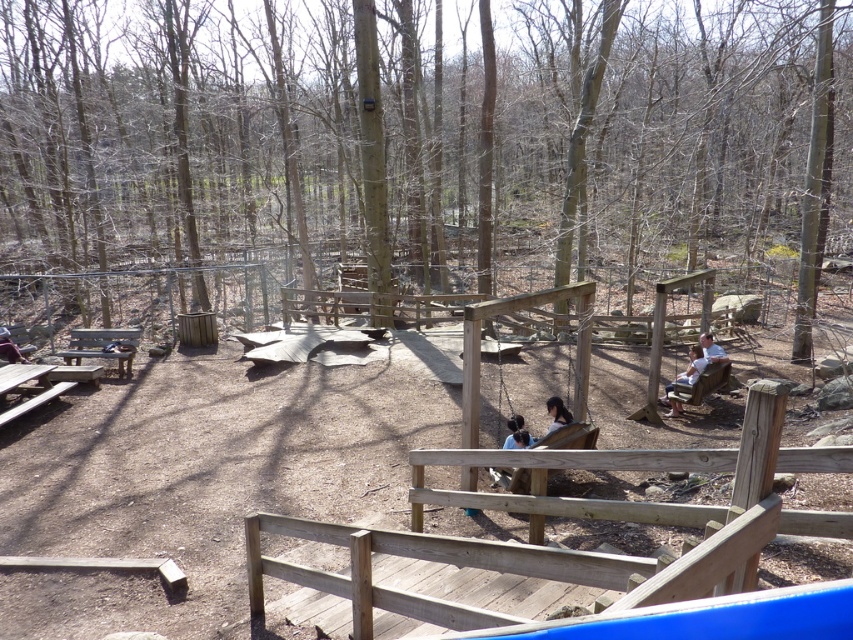
You are a park visitor who wants to sit on the dark brown wooden swing at center. Is the dark brown leather jacket at lower left blocking your path to the swing?

The dark brown wooden swing at center is below the dark brown leather jacket at lower left, so the jacket is positioned above the swing. This means the jacket is not directly blocking the path to the swing, but it might be in the way depending on the exact positioning.

You are a parent trying to decide between placing your child on the wooden bench at left or the dark brown wooden swing at center. Considering the height of the objects, which one is taller?

The wooden bench at left is taller than the dark brown wooden swing at center.